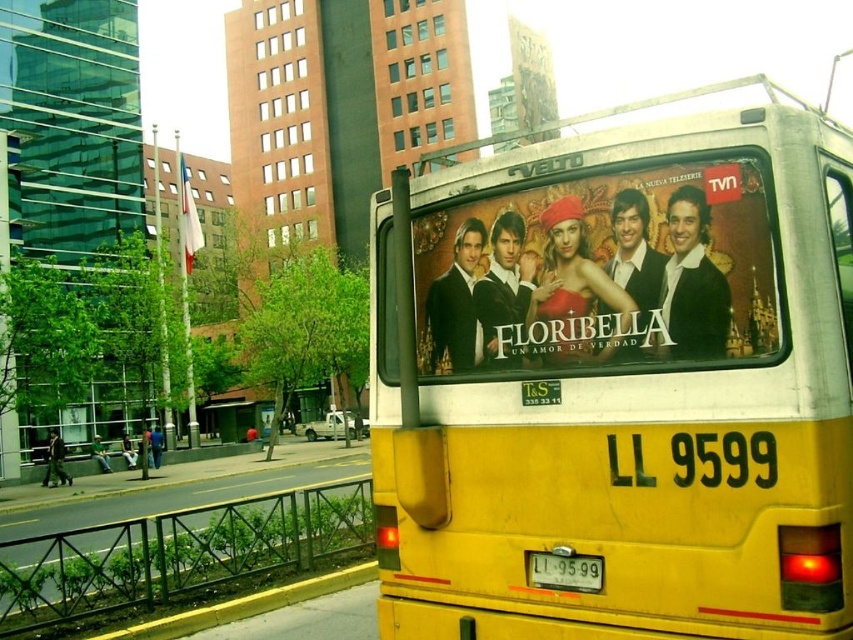
Which is more to the left, yellow matte bus at center or white plastic license plate at center?

yellow matte bus at center

Between yellow matte bus at center and white plastic license plate at center, which one has less height?

Standing shorter between the two is white plastic license plate at center.

Is point (811, 598) positioned in front of point (598, 564)?

Yes, it is.

At what (x,y) coordinates should I click in order to perform the action: click on yellow matte bus at center. Please return your answer as a coordinate pair (x, y). The height and width of the screenshot is (640, 853). Looking at the image, I should click on (619, 380).

Between matte black poster at center and white plastic license plate at center, which one is positioned higher?

matte black poster at center

Does point (540, 298) come in front of point (593, 582)?

No, it is not.

What do you see at coordinates (601, 273) in the screenshot?
I see `matte black poster at center` at bounding box center [601, 273].

Image resolution: width=853 pixels, height=640 pixels. Find the location of `matte black poster at center`. matte black poster at center is located at coordinates (601, 273).

Is yellow matte bus at center further to the viewer compared to matte black poster at center?

No.

Can you confirm if yellow matte bus at center is taller than matte black poster at center?

Yes, yellow matte bus at center is taller than matte black poster at center.

The width and height of the screenshot is (853, 640). I want to click on yellow matte bus at center, so click(619, 380).

At what (x,y) coordinates should I click in order to perform the action: click on yellow matte bus at center. Please return your answer as a coordinate pair (x, y). Looking at the image, I should click on (619, 380).